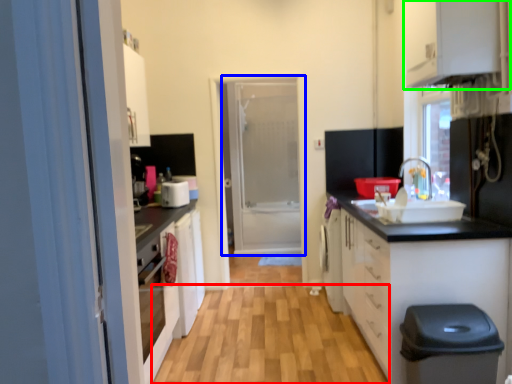
Question: Which object is positioned closest to plain (highlighted by a red box)? Select from door (highlighted by a blue box) and cabinetry (highlighted by a green box).

Choices:
 (A) door
 (B) cabinetry

Answer: (B)